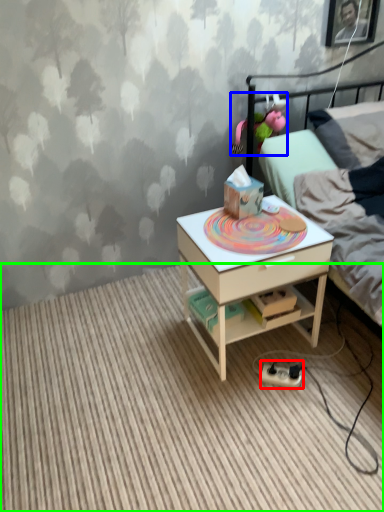
Question: Considering the real-world distances, which object is closest to equipment (highlighted by a red box)? toy (highlighted by a blue box) or plain (highlighted by a green box).

Choices:
 (A) toy
 (B) plain

Answer: (B)